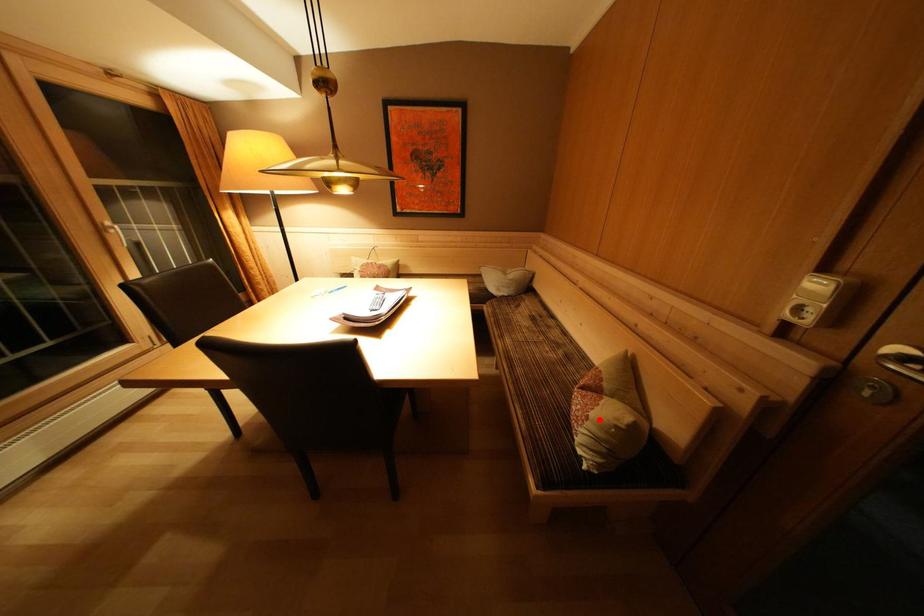
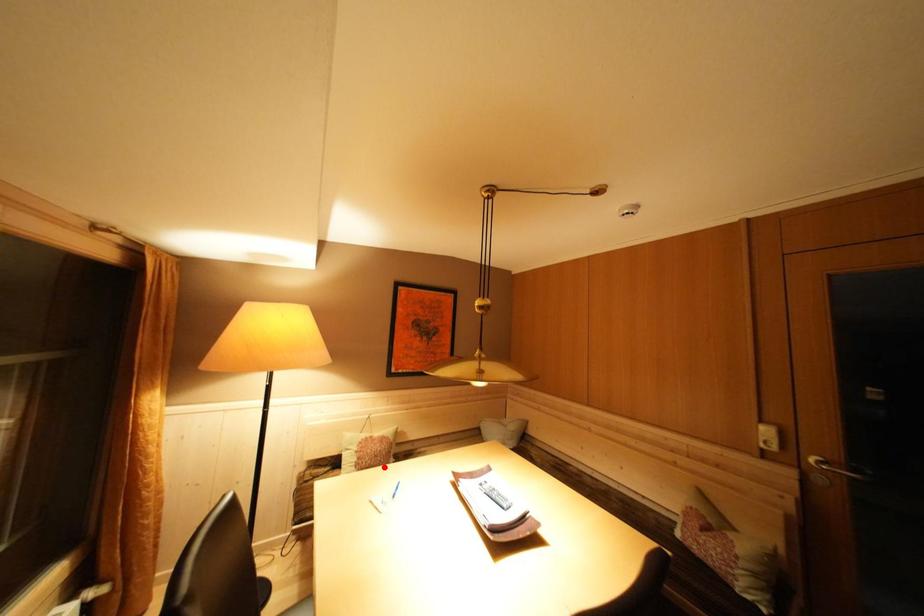
I am providing you with two images of the same scene from different viewpoints. A red point is marked on the first image and another point is marked on the second image. Do the highlighted points in image1 and image2 indicate the same real-world spot?

No